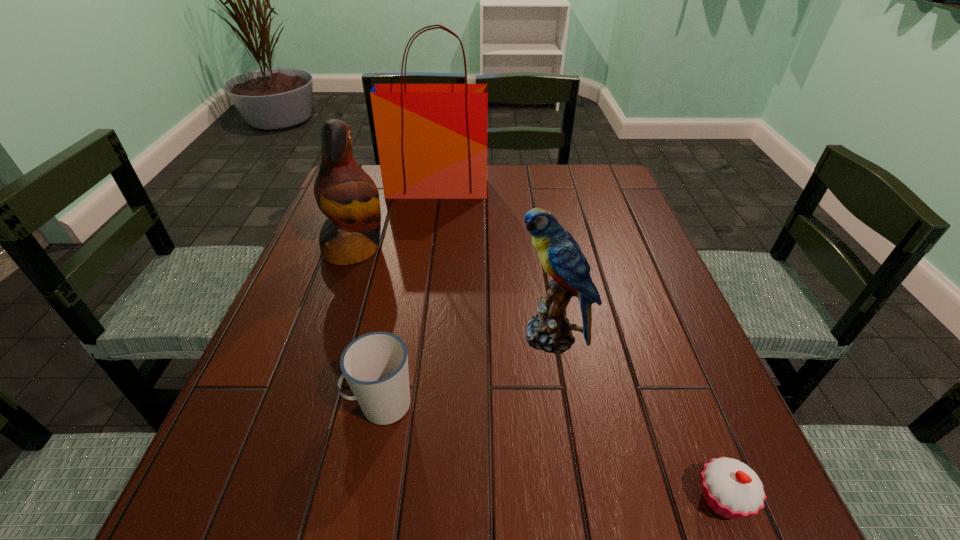
The image size is (960, 540). I want to click on shopping bag, so click(x=432, y=138).

You are a GUI agent. You are given a task and a screenshot of the screen. Output one action in this format:
    pyautogui.click(x=<x>, y=<y>)
    Task: Click on the tallest object
    
    Given the screenshot: What is the action you would take?
    pyautogui.click(x=432, y=138)

The height and width of the screenshot is (540, 960). In order to click on the left parrot in this screenshot , I will do `click(348, 197)`.

At what (x,y) coordinates should I click in order to perform the action: click on the farther parrot. Please return your answer as a coordinate pair (x, y). Looking at the image, I should click on (348, 197).

The image size is (960, 540). In order to click on the nearer parrot in this screenshot , I will do `click(560, 255)`.

This screenshot has height=540, width=960. I want to click on the right parrot, so (x=560, y=255).

Where is `the fourth farthest object`? This screenshot has height=540, width=960. the fourth farthest object is located at coordinates (375, 365).

Locate an element on the screen. cup is located at coordinates (375, 365).

Where is `the nearest object`? This screenshot has width=960, height=540. the nearest object is located at coordinates (732, 489).

Where is `cupcake`? cupcake is located at coordinates (732, 489).